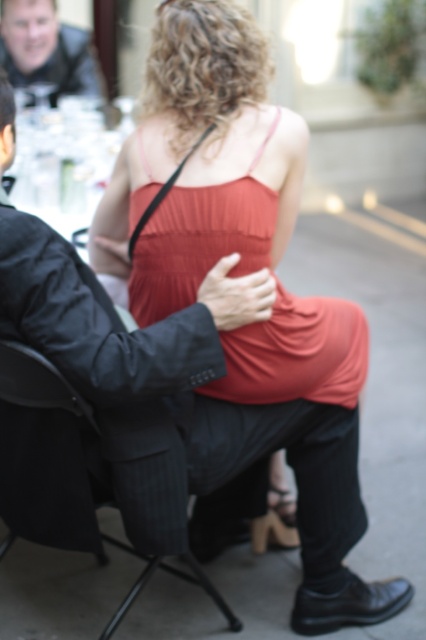
Question: Which point is closer to the camera?

Choices:
 (A) black pinstripe suit at center
 (B) matte red dress at center
 (C) white glossy table at upper left
 (D) black fabric chair at lower center

Answer: (A)

Question: Can you confirm if matte red dress at center is thinner than white glossy table at upper left?

Choices:
 (A) yes
 (B) no

Answer: (B)

Question: Among these objects, which one is farthest from the camera?

Choices:
 (A) matte red dress at center
 (B) white glossy table at upper left
 (C) black fabric chair at lower center
 (D) black pinstripe suit at center

Answer: (B)

Question: Is white glossy table at upper left to the left of black fabric chair at lower center from the viewer's perspective?

Choices:
 (A) no
 (B) yes

Answer: (B)

Question: Is matte black jacket at upper left above black fabric chair at lower center?

Choices:
 (A) yes
 (B) no

Answer: (A)

Question: Which point appears farthest from the camera in this image?

Choices:
 (A) (83, 209)
 (B) (131, 212)
 (C) (241, 307)
 (D) (31, 355)

Answer: (A)